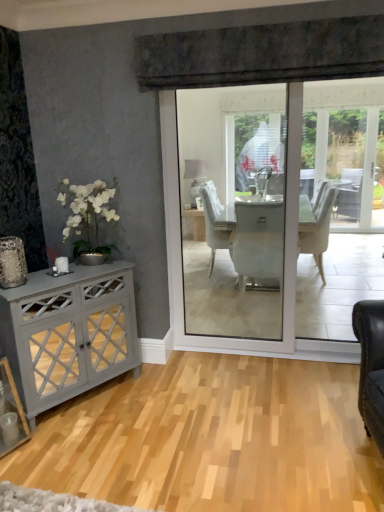
Question: Is natural wood floor at center further to camera compared to matte gray cabinet at left?

Choices:
 (A) yes
 (B) no

Answer: (B)

Question: From a real-world perspective, is natural wood floor at center on matte gray cabinet at left?

Choices:
 (A) yes
 (B) no

Answer: (B)

Question: Considering the relative sizes of natural wood floor at center and matte gray cabinet at left in the image provided, is natural wood floor at center bigger than matte gray cabinet at left?

Choices:
 (A) no
 (B) yes

Answer: (A)

Question: Does natural wood floor at center have a greater height compared to matte gray cabinet at left?

Choices:
 (A) yes
 (B) no

Answer: (B)

Question: Is natural wood floor at center at the right side of matte gray cabinet at left?

Choices:
 (A) yes
 (B) no

Answer: (A)

Question: Is natural wood floor at center aimed at matte gray cabinet at left?

Choices:
 (A) no
 (B) yes

Answer: (A)

Question: Are matte gray cabinet at left and natural wood floor at center beside each other?

Choices:
 (A) yes
 (B) no

Answer: (B)

Question: Is matte gray cabinet at left positioned beyond the bounds of natural wood floor at center?

Choices:
 (A) yes
 (B) no

Answer: (A)

Question: Considering the relative positions of matte gray cabinet at left and natural wood floor at center in the image provided, is matte gray cabinet at left behind natural wood floor at center?

Choices:
 (A) no
 (B) yes

Answer: (B)

Question: From the image's perspective, does matte gray cabinet at left appear lower than natural wood floor at center?

Choices:
 (A) yes
 (B) no

Answer: (B)

Question: Is matte gray cabinet at left wider than natural wood floor at center?

Choices:
 (A) yes
 (B) no

Answer: (B)

Question: Is matte gray cabinet at left taller than natural wood floor at center?

Choices:
 (A) yes
 (B) no

Answer: (A)

Question: Looking at the image, does matte gray cabinet at left seem bigger or smaller compared to natural wood floor at center?

Choices:
 (A) small
 (B) big

Answer: (B)